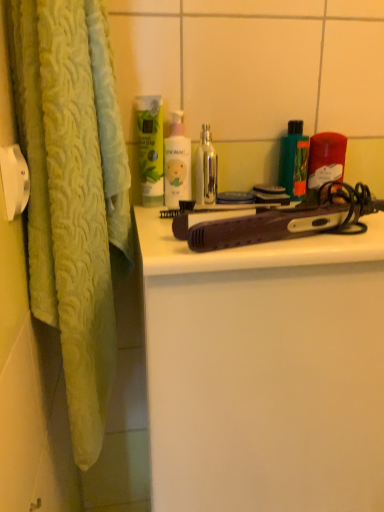
The height and width of the screenshot is (512, 384). I want to click on white matte bottle at center, which is counted as the first cleaning product, starting from the right, so click(177, 162).

This screenshot has width=384, height=512. I want to click on green matte bottle at upper right, which appears as the first product when viewed from the left, so click(294, 160).

Find the location of a particular element. The image size is (384, 512). purple plastic hair straightener at center is located at coordinates (251, 249).

Where is `purple plastic hair straightener at center`? purple plastic hair straightener at center is located at coordinates (265, 371).

Measure the distance between point (152, 170) and camera.

28.58 inches.

Identify the location of translucent plastic container at upper right, which ranks as the 1th product in right-to-left order. (326, 159).

What do you see at coordinates (326, 159) in the screenshot? I see `translucent plastic container at upper right, which ranks as the 1th product in right-to-left order` at bounding box center [326, 159].

I want to click on white matte bottle at center, which is counted as the first cleaning product, starting from the right, so click(177, 162).

Image resolution: width=384 pixels, height=512 pixels. Find the location of `the 2nd product behind the purple plastic hair straightener at center, counting from the anchor's position`. the 2nd product behind the purple plastic hair straightener at center, counting from the anchor's position is located at coordinates (326, 159).

Which is more to the right, purple plastic hair straightener at center or translucent plastic container at upper right, which ranks as the 1th product in right-to-left order?

translucent plastic container at upper right, which ranks as the 1th product in right-to-left order, is more to the right.

Looking at this image, does purple plastic hair straightener at center have a larger size compared to translucent plastic container at upper right, the second product when ordered from left to right?

Yes.

Would you say white matte bottle at center, which is counted as the first cleaning product, starting from the right, contains green matte bottle at upper right, arranged as the 2th product when viewed from the right?

That's incorrect, green matte bottle at upper right, arranged as the 2th product when viewed from the right, is not inside white matte bottle at center, which is counted as the first cleaning product, starting from the right.

Visually, is white matte bottle at center, the 2th cleaning product when ordered from left to right, positioned to the left or to the right of green matte bottle at upper right, which appears as the first product when viewed from the left?

From the image, it's evident that white matte bottle at center, the 2th cleaning product when ordered from left to right, is to the left of green matte bottle at upper right, which appears as the first product when viewed from the left.

Which object is further away from the camera taking this photo, white matte bottle at center, the 2th cleaning product when ordered from left to right, or green matte bottle at upper right, which appears as the first product when viewed from the left?

Positioned behind is green matte bottle at upper right, which appears as the first product when viewed from the left.

Which is in front, point (173, 132) or point (287, 168)?

Positioned in front is point (173, 132).

Does point (156, 106) appear closer or farther from the camera than point (204, 149)?

Clearly, point (156, 106) is closer to the camera than point (204, 149).

Which of these two, green matte lotion at upper center, which is the second cleaning product in right-to-left order, or metallic silver bottle at center, is wider?

With larger width is metallic silver bottle at center.

Looking at this image, is green matte lotion at upper center, which is the 1th cleaning product in left-to-right order, directly adjacent to metallic silver bottle at center?

Yes, green matte lotion at upper center, which is the 1th cleaning product in left-to-right order, is next to metallic silver bottle at center.

Is purple plastic hair straightener at center at the right side of green matte bottle at upper right, arranged as the 2th product when viewed from the right?

In fact, purple plastic hair straightener at center is to the left of green matte bottle at upper right, arranged as the 2th product when viewed from the right.

From the image's perspective, would you say purple plastic hair straightener at center is positioned over green matte bottle at upper right, arranged as the 2th product when viewed from the right?

No, from the image's perspective, purple plastic hair straightener at center is not on top of green matte bottle at upper right, arranged as the 2th product when viewed from the right.

Which of these two, purple plastic hair straightener at center or green matte bottle at upper right, arranged as the 2th product when viewed from the right, is wider?

Wider between the two is purple plastic hair straightener at center.

Is purple plastic hair straightener at center turned away from green matte bottle at upper right, which appears as the first product when viewed from the left?

No.

From the image's perspective, would you say metallic silver bottle at center is shown under translucent plastic container at upper right, the second product when ordered from left to right?

Yes, from the image's perspective, metallic silver bottle at center is beneath translucent plastic container at upper right, the second product when ordered from left to right.

Would you consider metallic silver bottle at center to be distant from translucent plastic container at upper right, which ranks as the 1th product in right-to-left order?

metallic silver bottle at center is near translucent plastic container at upper right, which ranks as the 1th product in right-to-left order, not far away.

Consider the image. Relative to translucent plastic container at upper right, which ranks as the 1th product in right-to-left order, is metallic silver bottle at center in front or behind?

Clearly, metallic silver bottle at center is in front of translucent plastic container at upper right, which ranks as the 1th product in right-to-left order.

What's the angular difference between metallic silver bottle at center and translucent plastic container at upper right, the second product when ordered from left to right,'s facing directions?

6.38e-05 degrees separate the facing orientations of metallic silver bottle at center and translucent plastic container at upper right, the second product when ordered from left to right.

From the image's perspective, who appears lower, white matte bottle at center, the 2th cleaning product when ordered from left to right, or metallic silver bottle at center?

metallic silver bottle at center is shown below in the image.

Is white matte bottle at center, which is counted as the first cleaning product, starting from the right, oriented towards metallic silver bottle at center?

No, white matte bottle at center, which is counted as the first cleaning product, starting from the right, is not aimed at metallic silver bottle at center.

Considering their positions, is white matte bottle at center, the 2th cleaning product when ordered from left to right, located in front of or behind metallic silver bottle at center?

Clearly, white matte bottle at center, the 2th cleaning product when ordered from left to right, is in front of metallic silver bottle at center.

Visually, is white matte bottle at center, which is counted as the first cleaning product, starting from the right, positioned to the left or to the right of metallic silver bottle at center?

Clearly, white matte bottle at center, which is counted as the first cleaning product, starting from the right, is on the left of metallic silver bottle at center in the image.

Which of these two, purple plastic hair straightener at center or translucent plastic container at upper right, which ranks as the 1th product in right-to-left order, is bigger?

purple plastic hair straightener at center.

Is purple plastic hair straightener at center oriented towards translucent plastic container at upper right, the second product when ordered from left to right?

No, purple plastic hair straightener at center is not turned towards translucent plastic container at upper right, the second product when ordered from left to right.

Considering the positions of objects purple plastic hair straightener at center and translucent plastic container at upper right, the second product when ordered from left to right, in the image provided, who is more to the left, purple plastic hair straightener at center or translucent plastic container at upper right, the second product when ordered from left to right,?

purple plastic hair straightener at center is more to the left.

This screenshot has height=512, width=384. Identify the location of bathroom cabinet located below the translucent plastic container at upper right, which ranks as the 1th product in right-to-left order (from the image's perspective). (265, 371).

This screenshot has width=384, height=512. I want to click on the 1st cleaning product above the green matte bottle at upper right, which appears as the first product when viewed from the left (from a real-world perspective), so click(x=177, y=162).

When comparing their distances from metallic silver bottle at center, does green matte lotion at upper center, which is the 1th cleaning product in left-to-right order, or green matte bottle at upper right, arranged as the 2th product when viewed from the right, seem closer?

green matte lotion at upper center, which is the 1th cleaning product in left-to-right order, is closer to metallic silver bottle at center.

Looking at the image, which one is located further to metallic silver bottle at center, white matte bottle at center, the 2th cleaning product when ordered from left to right, or green matte lotion at upper center, which is the second cleaning product in right-to-left order?

Based on the image, green matte lotion at upper center, which is the second cleaning product in right-to-left order, appears to be further to metallic silver bottle at center.

Considering their positions, is purple plastic hair straightener at center positioned closer to green matte bottle at upper right, which appears as the first product when viewed from the left, than white matte bottle at center, the 2th cleaning product when ordered from left to right?

white matte bottle at center, the 2th cleaning product when ordered from left to right.

Looking at this image, considering their positions, is purple plastic hair straightener at center positioned closer to green matte bottle at upper right, arranged as the 2th product when viewed from the right, than white matte bottle at center, the 2th cleaning product when ordered from left to right?

white matte bottle at center, the 2th cleaning product when ordered from left to right.

From the image, which object appears to be farther from green matte bottle at upper right, arranged as the 2th product when viewed from the right, green matte lotion at upper center, which is the 1th cleaning product in left-to-right order, or purple plastic hair straightener at center?

Based on the image, purple plastic hair straightener at center appears to be further to green matte bottle at upper right, arranged as the 2th product when viewed from the right.

Estimate the real-world distances between objects in this image. Which object is further from metallic silver bottle at center, white matte bottle at center, which is counted as the first cleaning product, starting from the right, or green matte bottle at upper right, which appears as the first product when viewed from the left?

The object further to metallic silver bottle at center is green matte bottle at upper right, which appears as the first product when viewed from the left.

Considering their positions, is white matte bottle at center, the 2th cleaning product when ordered from left to right, positioned closer to green matte lotion at upper center, which is the second cleaning product in right-to-left order, than metallic silver bottle at center?

Among the two, white matte bottle at center, the 2th cleaning product when ordered from left to right, is located nearer to green matte lotion at upper center, which is the second cleaning product in right-to-left order.

When comparing their distances from purple plastic hair straightener at center, does translucent plastic container at upper right, which ranks as the 1th product in right-to-left order, or metallic silver bottle at center seem closer?

metallic silver bottle at center lies closer to purple plastic hair straightener at center than the other object.

Identify the location of product between white matte bottle at center, which is counted as the first cleaning product, starting from the right, and translucent plastic container at upper right, the second product when ordered from left to right, from left to right. (294, 160).

Locate an element on the screen. The height and width of the screenshot is (512, 384). counter top that lies between green matte bottle at upper right, which appears as the first product when viewed from the left, and purple plastic hair straightener at center from top to bottom is located at coordinates (251, 249).

Identify the location of product situated between green matte lotion at upper center, which is the 1th cleaning product in left-to-right order, and translucent plastic container at upper right, the second product when ordered from left to right, from left to right. (294, 160).

The image size is (384, 512). I want to click on counter top between green matte lotion at upper center, which is the second cleaning product in right-to-left order, and purple plastic hair straightener at center from top to bottom, so click(251, 249).